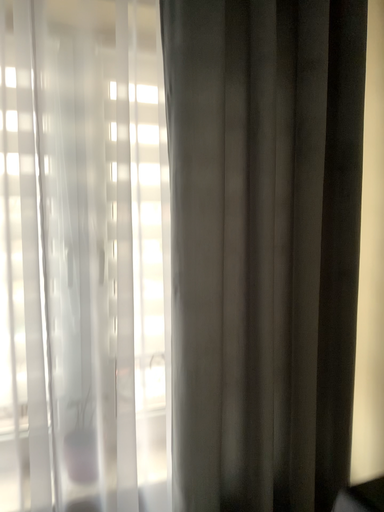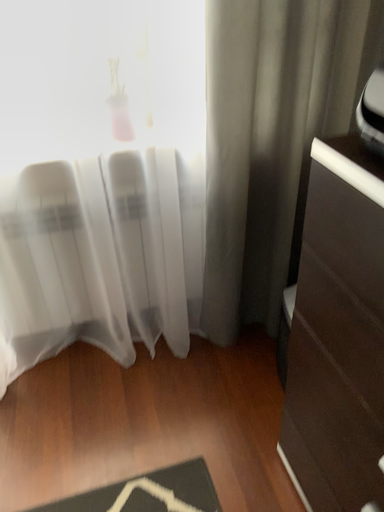
Question: Which way did the camera rotate in the video?

Choices:
 (A) rotated downward
 (B) rotated upward

Answer: (A)